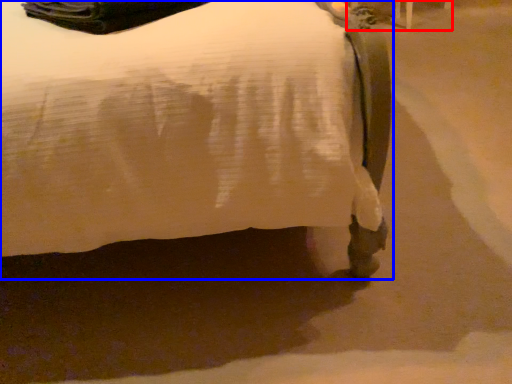
Question: Which object appears closest to the camera in this image, furniture (highlighted by a red box) or bed (highlighted by a blue box)?

Choices:
 (A) furniture
 (B) bed

Answer: (B)